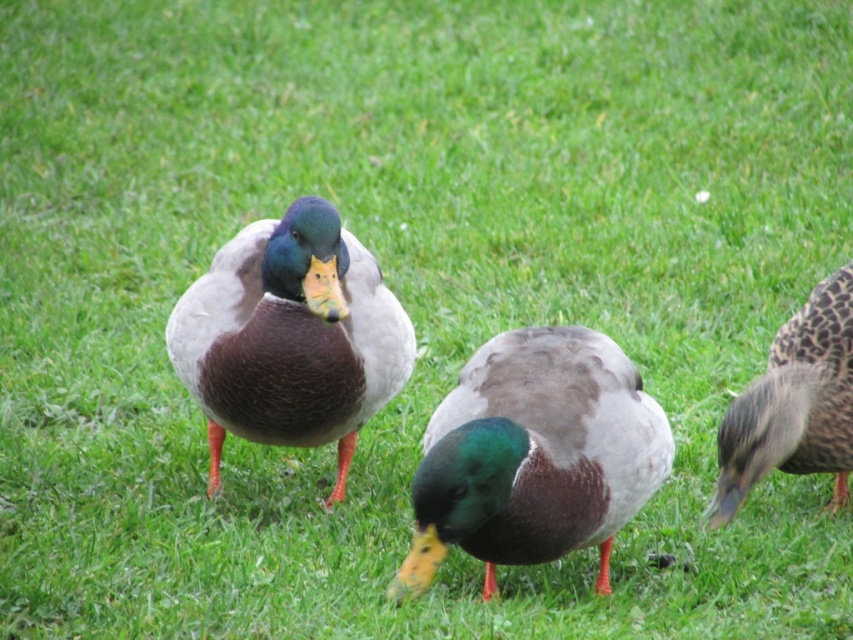
You are a birdwatcher observing the ducks in the scene. You notice the shiny brown duck at center and the brown speckled feathers at right. Which duck is positioned higher in the image?

The shiny brown duck at center is positioned higher than the brown speckled feathers at right.

In the scene shown: You are a wildlife photographer trying to capture a photo of the green glossy duck at center and the shiny brown duck at center. Which duck should you focus on if you want to photograph the taller one?

The shiny brown duck at center is taller than the green glossy duck at center, so you should focus on the shiny brown duck at center to photograph the taller one.

You are a photographer trying to capture a clear shot of the green glossy duck at center and the brown speckled feathers at right. Which duck will appear closer to the camera in your photo?

The green glossy duck at center will appear closer to the camera because it is positioned in front of the brown speckled feathers at right.